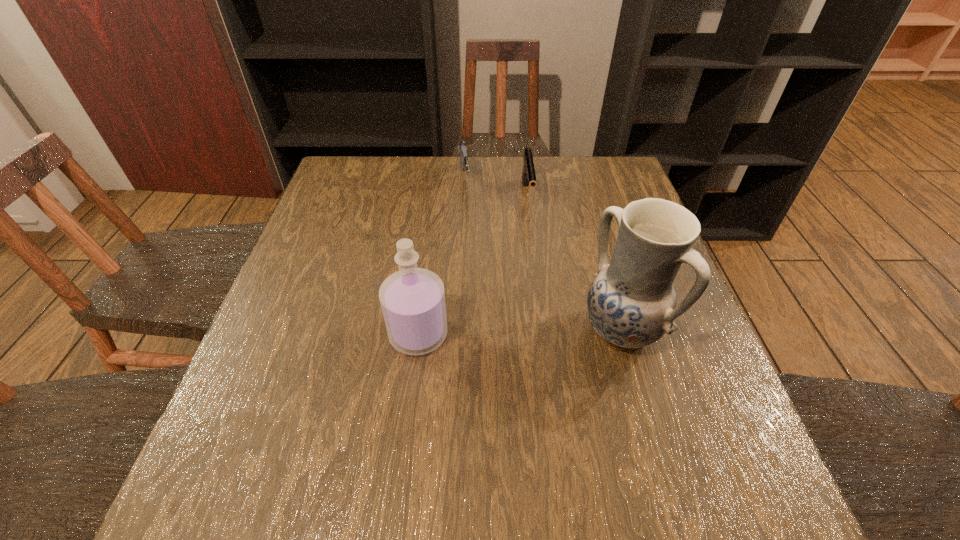
At what (x,y) coordinates should I click in order to perform the action: click on free location located at the barrel of the gun. Please return your answer as a coordinate pair (x, y). This screenshot has height=540, width=960. Looking at the image, I should click on (470, 242).

This screenshot has height=540, width=960. I want to click on free space located at the barrel of the gun, so click(x=468, y=225).

You are a GUI agent. You are given a task and a screenshot of the screen. Output one action in this format:
    pyautogui.click(x=<x>, y=<y>)
    Task: Click on the pistol present at the far edge
    Image resolution: width=960 pixels, height=540 pixels.
    Given the screenshot: What is the action you would take?
    pyautogui.click(x=528, y=173)

This screenshot has height=540, width=960. I want to click on gun present at the far edge, so click(x=462, y=147).

I want to click on object present at the right edge, so click(631, 303).

Identify the location of free space at the far edge of the desktop. This screenshot has width=960, height=540. (520, 189).

This screenshot has width=960, height=540. Identify the location of vacant space at the near edge. (559, 447).

In the image, there is a desktop. What are the coordinates of `vacant space at the left edge` in the screenshot? It's located at point(348,211).

In the image, there is a desktop. Where is `vacant space at the right edge`? This screenshot has height=540, width=960. vacant space at the right edge is located at coordinates click(684, 384).

In the image, there is a desktop. Identify the location of vacant space at the far left corner. The image size is (960, 540). (348, 166).